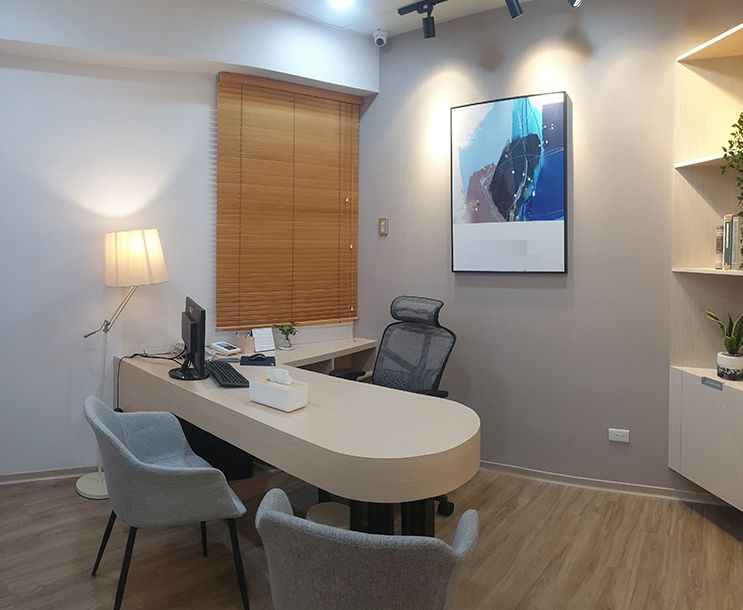
This screenshot has width=743, height=610. Find the location of `lamp base`. lamp base is located at coordinates (91, 487).